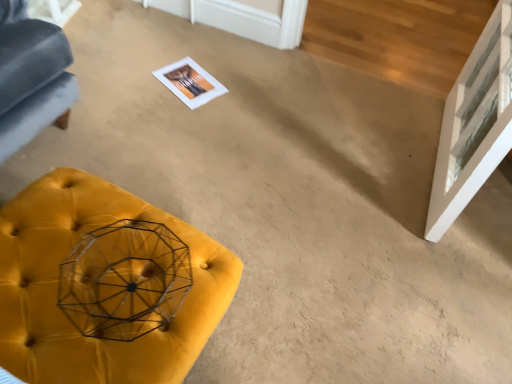
The width and height of the screenshot is (512, 384). I want to click on free space behind transparent glass door at upper right, so click(378, 101).